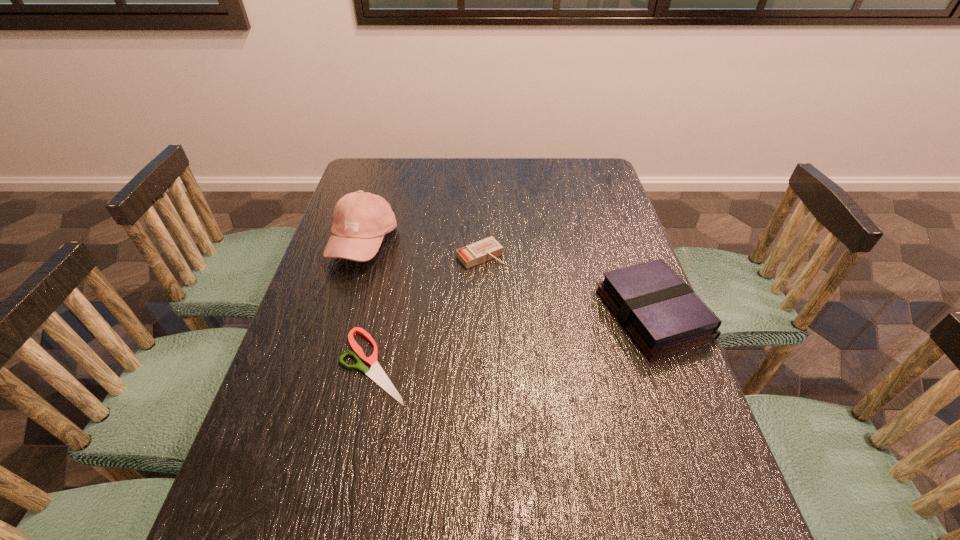
You are a GUI agent. You are given a task and a screenshot of the screen. Output one action in this format:
    pyautogui.click(x=<x>, y=<y>)
    Task: Click on the shortest object
    
    Given the screenshot: What is the action you would take?
    pyautogui.click(x=376, y=373)

Where is `the rightmost object`? This screenshot has width=960, height=540. the rightmost object is located at coordinates (660, 312).

Find the location of a particular element. book is located at coordinates (660, 312).

The height and width of the screenshot is (540, 960). Find the location of `the tallest object`. the tallest object is located at coordinates (361, 219).

Locate an element on the screen. The image size is (960, 540). the third tallest object is located at coordinates (486, 249).

You are a GUI agent. You are given a task and a screenshot of the screen. Output one action in this format:
    pyautogui.click(x=<x>, y=<y>)
    Task: Click on the matchbox
    This screenshot has width=960, height=540.
    Given the screenshot: What is the action you would take?
    pyautogui.click(x=486, y=249)

Where is `vacant region located 0.120m on the left of the scissors`? The width and height of the screenshot is (960, 540). vacant region located 0.120m on the left of the scissors is located at coordinates (285, 366).

Where is `vacant space located on the left of the second tallest object`? The image size is (960, 540). vacant space located on the left of the second tallest object is located at coordinates (564, 314).

At what (x,y) coordinates should I click in order to perform the action: click on vacant area located 0.310m on the front-facing side of the baseball cap. Please return your answer as a coordinate pair (x, y). Looking at the image, I should click on tap(460, 323).

This screenshot has width=960, height=540. Find the location of `blank space located 0.260m on the front-facing side of the baseball cap`. blank space located 0.260m on the front-facing side of the baseball cap is located at coordinates (445, 313).